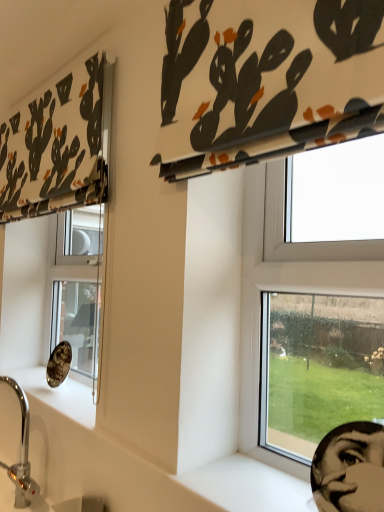
Question: In the image, is white smooth window sill at lower right positioned in front of or behind black matte human face at lower right?

Choices:
 (A) front
 (B) behind

Answer: (B)

Question: From their relative heights in the image, would you say white smooth window sill at lower right is taller or shorter than black matte human face at lower right?

Choices:
 (A) tall
 (B) short

Answer: (B)

Question: Which is farther from the white smooth window sill at lower right?

Choices:
 (A) chrome metallic sink at lower left
 (B) matte black fabric at upper center, arranged as the first curtain when viewed from the right
 (C) black matte human face at lower right
 (D) transparent glass window at center right
 (E) white fabric with black and orange cactus print at upper left, the 1th curtain in the left-to-right sequence

Answer: (E)

Question: Estimate the real-world distances between objects in this image. Which object is farther from the white smooth window sill at lower right?

Choices:
 (A) chrome metallic sink at lower left
 (B) black matte human face at lower right
 (C) transparent glass window at center right
 (D) matte black fabric at upper center, the 2th curtain positioned from the left
 (E) white fabric with black and orange cactus print at upper left, marked as the second curtain in a right-to-left arrangement

Answer: (E)